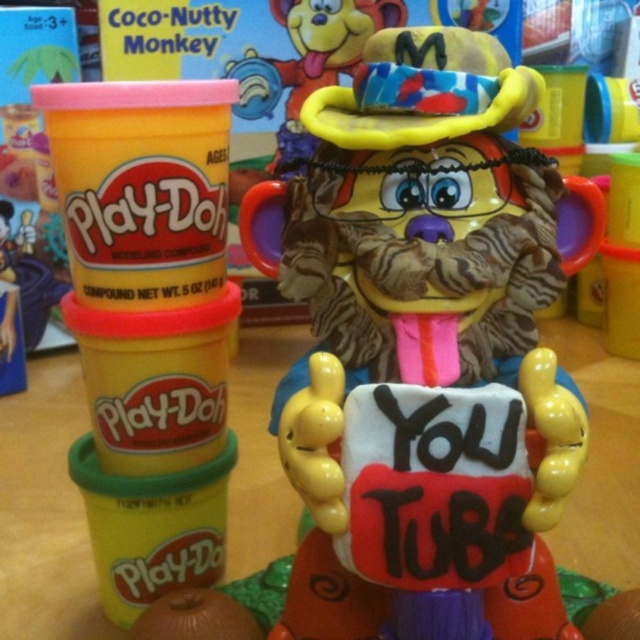
You are a toy organizer who needs to place the matte plastic monkey at center and the rubberized yellow ring at upper center into a storage box. The box has a maximum length of 30 inches. Can both items fit side by side in the box without overlapping?

The matte plastic monkey at center and the rubberized yellow ring at upper center are 29.86 inches apart, so yes, they can fit side by side in the box since the distance between them is less than the box length.

You are designing a layout for a childrens room and want to place a matte plastic monkey at center and a rubberized yellow ring at upper center. According to the scene, which object is positioned to the right side?

The matte plastic monkey at center is positioned to the right of the rubberized yellow ring at upper center.

You are designing a display for a toy store and need to ensure that the matte plastic monkey at center and the rubberized yellow ring at upper center can fit side by side on a shelf. Given that the shelf has a width of 30 cm, can both items be placed next to each other without overlapping?

The matte plastic monkey at center is wider than the rubberized yellow ring at upper center. However, since the exact widths are not provided, it is impossible to determine if their combined width exceeds 30 cm. Additional measurements are needed to confirm.